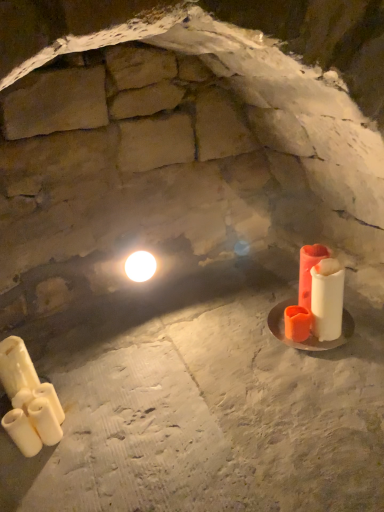
Question: Considering the positions of white matte candle at lower left, which is the 3th candle in right-to-left order, and matte orange candle at right, acting as the first candle starting from the right, in the image, is white matte candle at lower left, which is the 3th candle in right-to-left order, wider or thinner than matte orange candle at right, acting as the first candle starting from the right,?

Choices:
 (A) wide
 (B) thin

Answer: (B)

Question: In terms of size, does white matte candle at lower left, placed as the 3th candle when sorted from left to right, appear bigger or smaller than matte orange candle at right, acting as the first candle starting from the right?

Choices:
 (A) big
 (B) small

Answer: (B)

Question: Which object is the farthest from the white matte candle at lower left, which is the 3th candle in right-to-left order?

Choices:
 (A) white matte candle at lower left, which is counted as the 5th candle, starting from the right
 (B) white matte candle at lower left, the fourth candle from the left
 (C) white glossy light bulb at upper center
 (D) white matte candle at lower left, which ranks as the second candle in left-to-right order
 (E) matte orange candle at right, acting as the 5th candle starting from the left

Answer: (E)

Question: Considering the real-world distances, which object is farthest from the white matte candle at lower left, which ranks as the second candle in left-to-right order?

Choices:
 (A) white matte candle at lower left, placed as the 3th candle when sorted from left to right
 (B) white glossy light bulb at upper center
 (C) white matte candle at lower left, the fourth candle from the left
 (D) matte orange candle at right, acting as the first candle starting from the right
 (E) white matte candle at lower left, which is counted as the 5th candle, starting from the right

Answer: (D)